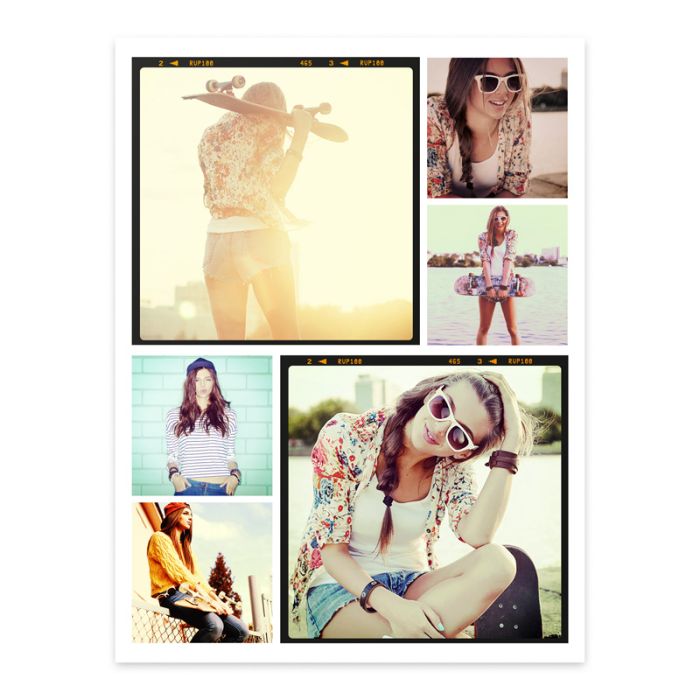
Locate an element on the screen. pictures that make up collage is located at coordinates (203, 411), (218, 540), (351, 477), (288, 266), (468, 140), (519, 262).